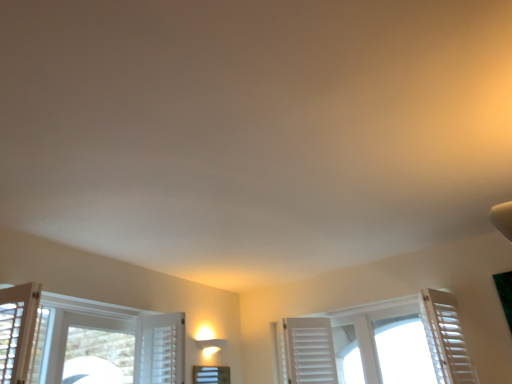
Question: From a real-world perspective, relative to white frosted glass window at center, which is counted as the 1th window, starting from the left, is white wooden shutters at center, placed as the 2th window when sorted from left to right, vertically above or below?

Choices:
 (A) above
 (B) below

Answer: (A)

Question: Looking at their shapes, would you say white wooden shutters at center, placed as the first window when sorted from right to left, is wider or thinner than white frosted glass window at center, the 2th window when ordered from right to left?

Choices:
 (A) wide
 (B) thin

Answer: (A)

Question: Which object is the farthest from the white matte shutter at right?

Choices:
 (A) white frosted glass window at center, which is counted as the 1th window, starting from the left
 (B) white wooden shutters at center, placed as the 2th window when sorted from left to right

Answer: (A)

Question: Considering the real-world distances, which object is closest to the white frosted glass window at center, which is counted as the 1th window, starting from the left?

Choices:
 (A) white wooden shutters at center, placed as the 2th window when sorted from left to right
 (B) white matte shutter at right

Answer: (A)